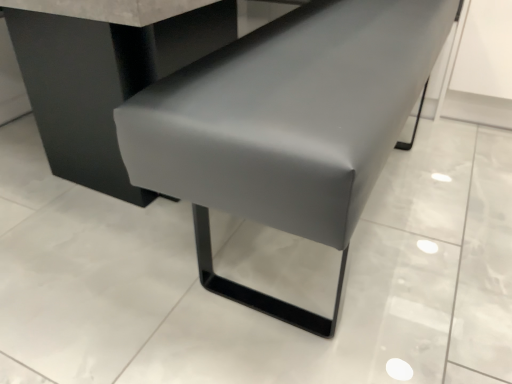
Question: Is matte gray concrete at center facing away from matte gray bench at center?

Choices:
 (A) yes
 (B) no

Answer: (B)

Question: From the image's perspective, is matte gray concrete at center on top of matte gray bench at center?

Choices:
 (A) yes
 (B) no

Answer: (A)

Question: Is matte gray bench at center inside matte gray concrete at center?

Choices:
 (A) no
 (B) yes

Answer: (B)

Question: Could you tell me if matte gray concrete at center is facing matte gray bench at center?

Choices:
 (A) yes
 (B) no

Answer: (A)

Question: Is matte gray concrete at center to the right of matte gray bench at center from the viewer's perspective?

Choices:
 (A) yes
 (B) no

Answer: (B)

Question: Is the depth of matte gray concrete at center less than that of matte gray bench at center?

Choices:
 (A) no
 (B) yes

Answer: (A)

Question: Is matte gray bench at center at the right side of matte gray concrete at center?

Choices:
 (A) no
 (B) yes

Answer: (B)

Question: Is matte gray bench at center positioned with its back to matte gray concrete at center?

Choices:
 (A) no
 (B) yes

Answer: (B)

Question: Is matte gray bench at center further to camera compared to matte gray concrete at center?

Choices:
 (A) yes
 (B) no

Answer: (B)

Question: Considering the relative sizes of matte gray bench at center and matte gray concrete at center in the image provided, is matte gray bench at center smaller than matte gray concrete at center?

Choices:
 (A) yes
 (B) no

Answer: (A)

Question: Does matte gray bench at center have a greater width compared to matte gray concrete at center?

Choices:
 (A) no
 (B) yes

Answer: (A)

Question: Is matte gray concrete at center inside matte gray bench at center?

Choices:
 (A) no
 (B) yes

Answer: (A)

Question: Considering the positions of point (342, 283) and point (478, 375), is point (342, 283) closer or farther from the camera than point (478, 375)?

Choices:
 (A) closer
 (B) farther

Answer: (B)